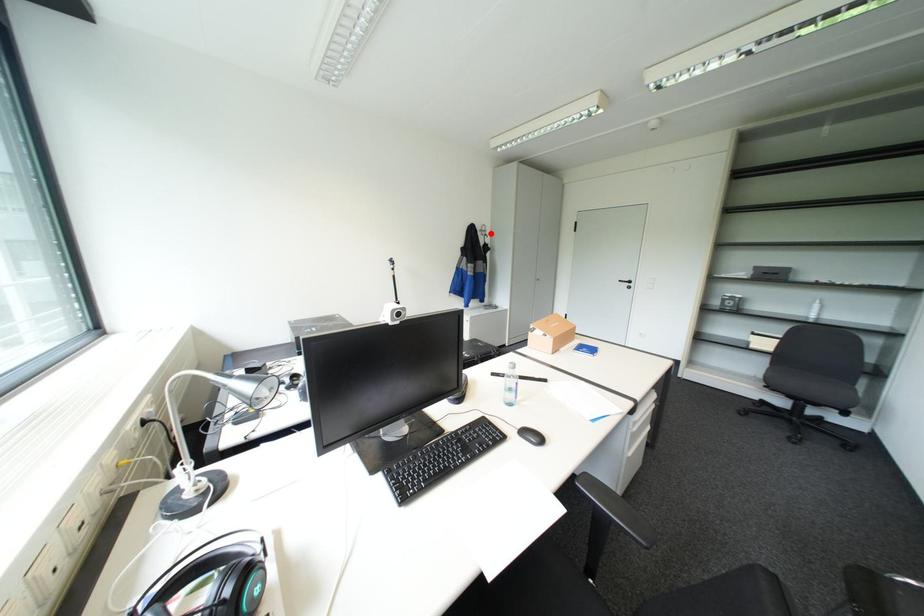
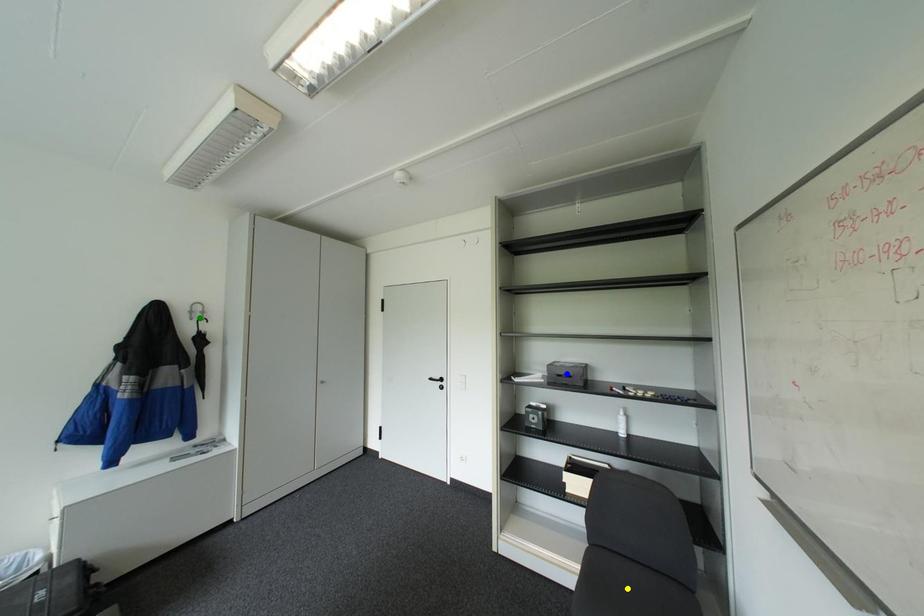
Question: I am providing you with two images of the same scene from different viewpoints. A red point is marked on the first image. You are given multiple points on the second image. In image 2, which mark is for the same physical point as the one in image 1?

Choices:
 (A) yellow point
 (B) blue point
 (C) green point

Answer: (C)